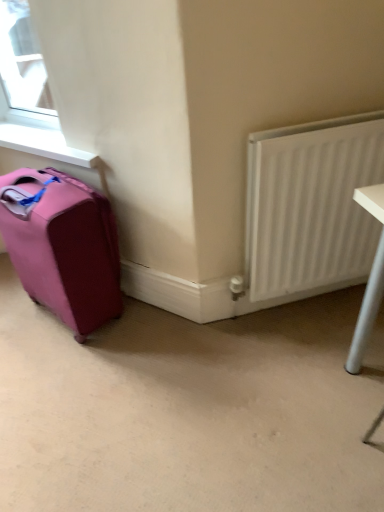
Question: Is white smooth window sill at upper left wider than pink fabric suitcase at left?

Choices:
 (A) yes
 (B) no

Answer: (B)

Question: Does white smooth window sill at upper left have a smaller size compared to pink fabric suitcase at left?

Choices:
 (A) no
 (B) yes

Answer: (B)

Question: Is the depth of white smooth window sill at upper left greater than that of pink fabric suitcase at left?

Choices:
 (A) yes
 (B) no

Answer: (A)

Question: Are white smooth window sill at upper left and pink fabric suitcase at left far apart?

Choices:
 (A) yes
 (B) no

Answer: (B)

Question: Considering the relative sizes of white smooth window sill at upper left and pink fabric suitcase at left in the image provided, is white smooth window sill at upper left taller than pink fabric suitcase at left?

Choices:
 (A) no
 (B) yes

Answer: (A)

Question: In terms of height, does white smooth window sill at upper left look taller or shorter compared to pink fabric suitcase at left?

Choices:
 (A) short
 (B) tall

Answer: (A)

Question: From a real-world perspective, relative to pink fabric suitcase at left, is white smooth window sill at upper left vertically above or below?

Choices:
 (A) above
 (B) below

Answer: (A)

Question: Would you say white smooth window sill at upper left is to the left or to the right of pink fabric suitcase at left in the picture?

Choices:
 (A) left
 (B) right

Answer: (A)

Question: Is point (13, 144) positioned closer to the camera than point (33, 264)?

Choices:
 (A) closer
 (B) farther

Answer: (B)

Question: Considering the relative positions of pink fabric suitcase at left and white smooth window sill at upper left in the image provided, is pink fabric suitcase at left to the left or to the right of white smooth window sill at upper left?

Choices:
 (A) left
 (B) right

Answer: (B)

Question: From the image's perspective, relative to white smooth window sill at upper left, is pink fabric suitcase at left above or below?

Choices:
 (A) above
 (B) below

Answer: (B)

Question: Is pink fabric suitcase at left situated inside white smooth window sill at upper left or outside?

Choices:
 (A) inside
 (B) outside

Answer: (B)

Question: Looking at their shapes, would you say pink fabric suitcase at left is wider or thinner than white smooth window sill at upper left?

Choices:
 (A) thin
 (B) wide

Answer: (B)

Question: From a real-world perspective, relative to white smooth window sill at upper left, is white textured radiator at right vertically above or below?

Choices:
 (A) below
 (B) above

Answer: (A)

Question: Considering the positions of white textured radiator at right and white smooth window sill at upper left in the image, is white textured radiator at right bigger or smaller than white smooth window sill at upper left?

Choices:
 (A) big
 (B) small

Answer: (A)